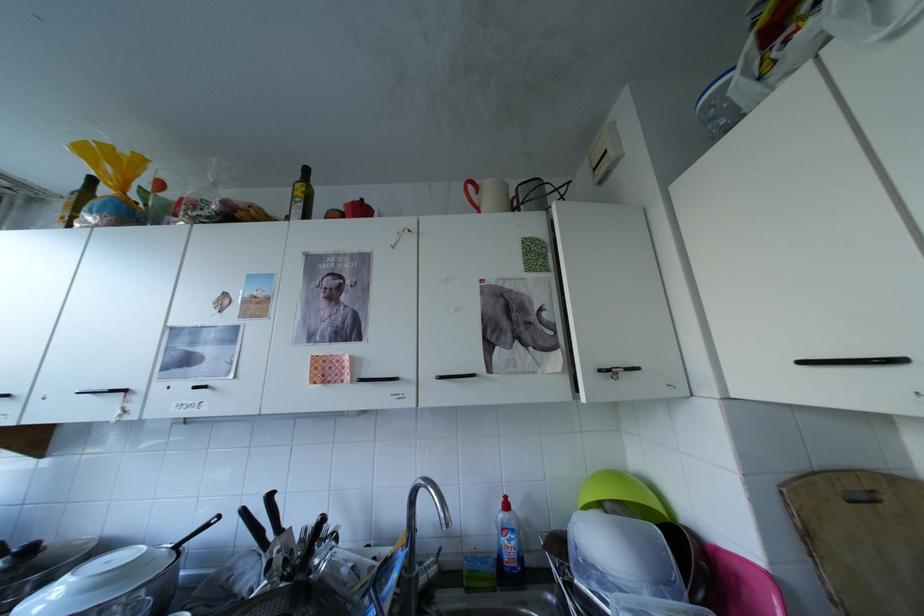
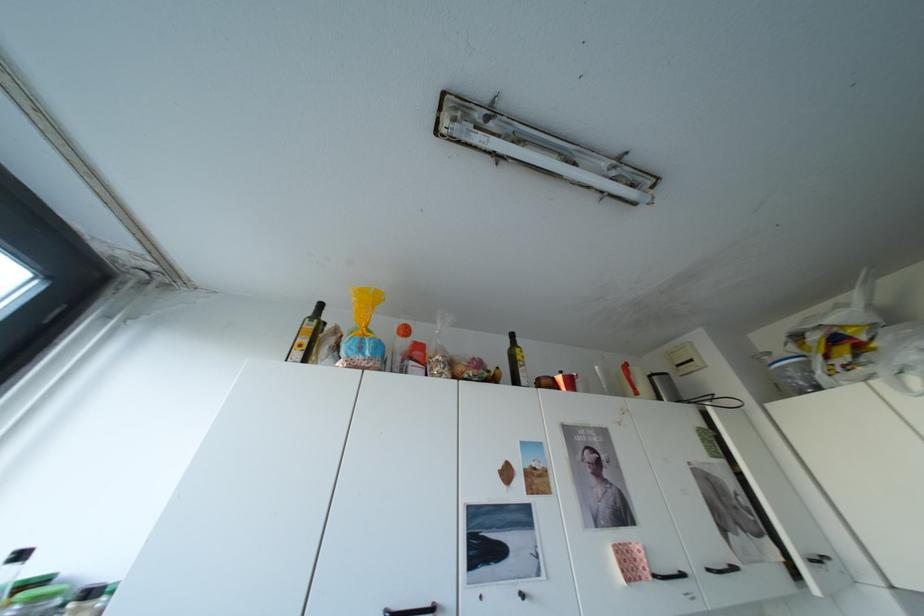
Question: In a continuous first-person perspective shot, in which direction is the camera moving?

Choices:
 (A) Left
 (B) Right
 (C) Forward
 (D) Backward

Answer: (A)